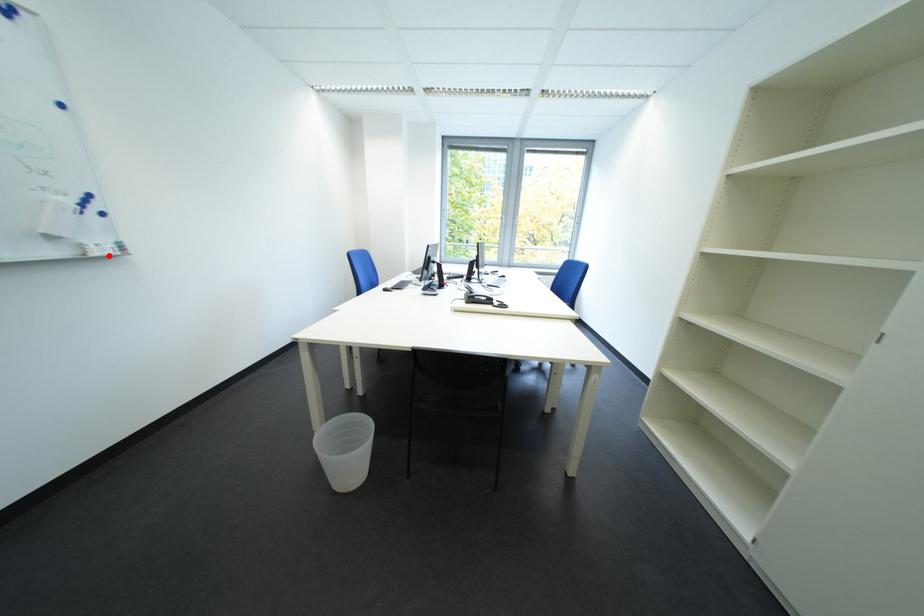
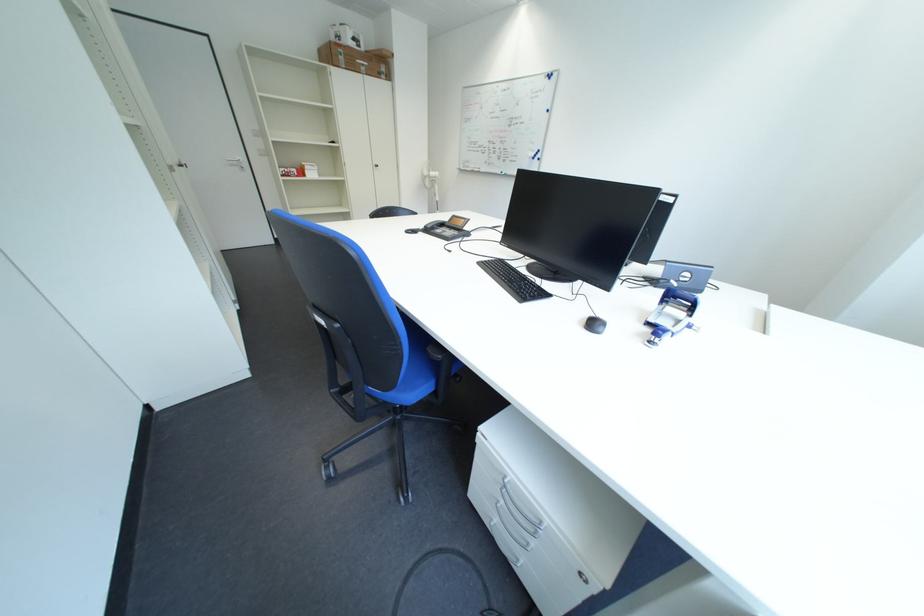
Question: I am providing you with two images of the same scene from different viewpoints. A red point is marked on the first image. Can you still see the location of the red point in image 2?

Choices:
 (A) Yes
 (B) No

Answer: (B)